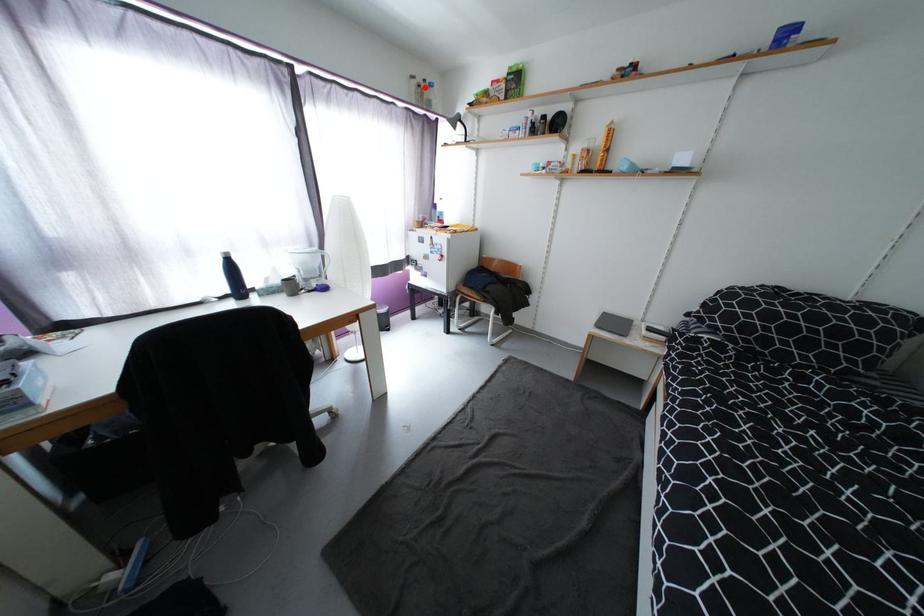
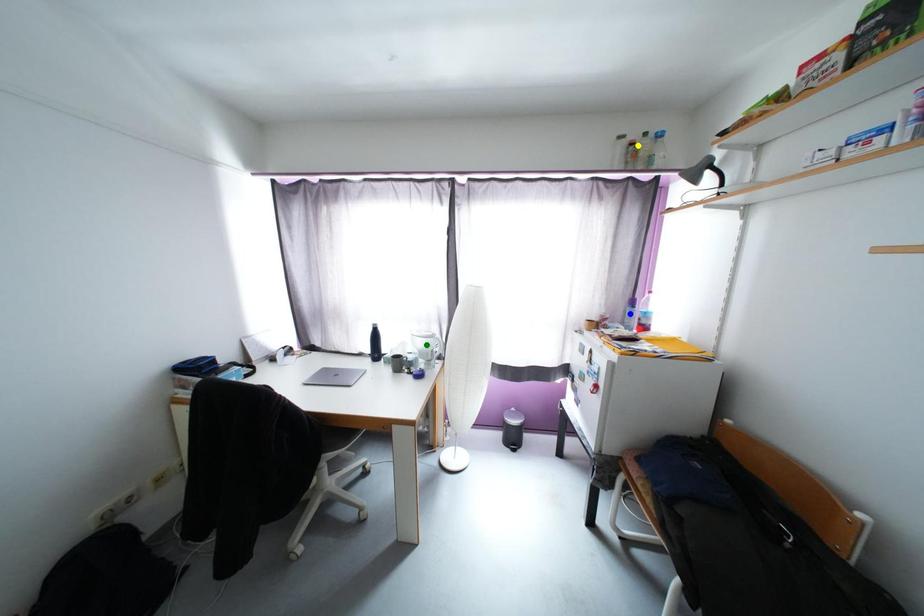
Question: I am providing you with two images of the same scene from different viewpoints. A red point is marked on the first image. You are given multiple points on the second image. Which point in image 2 represents the same 3d spot as the red point in image 1?

Choices:
 (A) blue point
 (B) yellow point
 (C) green point

Answer: (B)